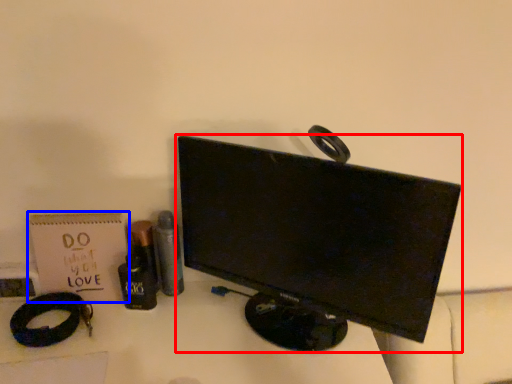
Question: Among these objects, which one is nearest to the camera, computer monitor (highlighted by a red box) or paperback book (highlighted by a blue box)?

Choices:
 (A) computer monitor
 (B) paperback book

Answer: (A)